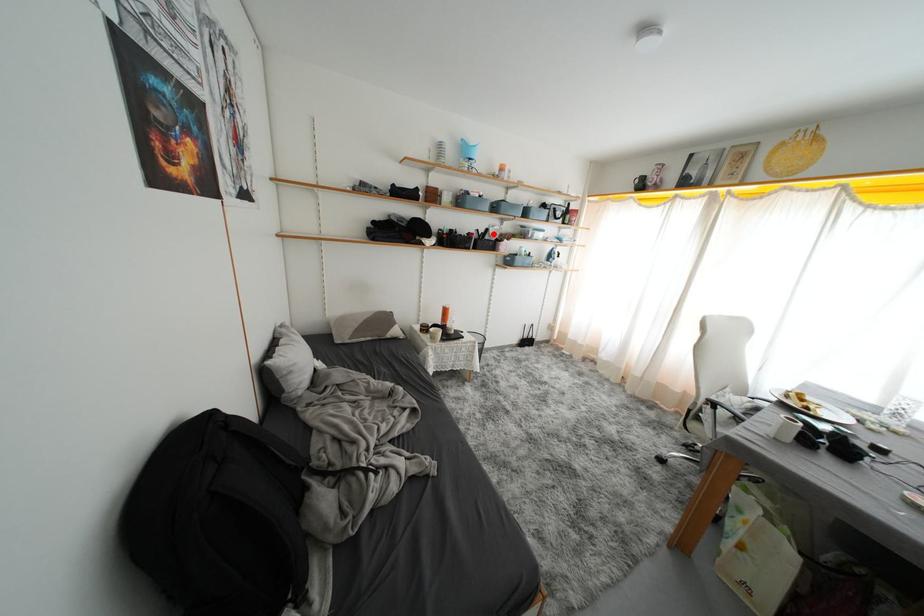
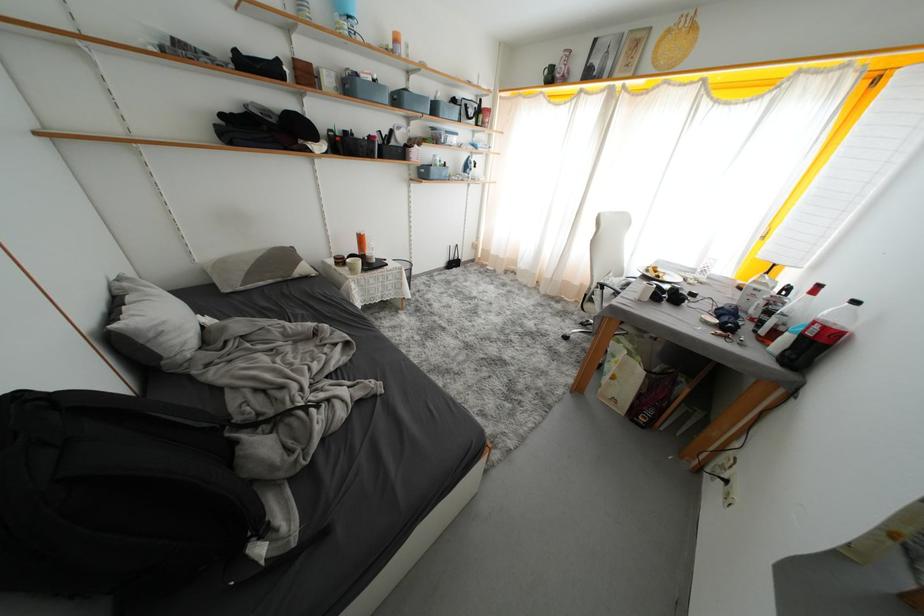
In the second image, find the point that corresponds to the highlighted location in the first image.

(397, 136)